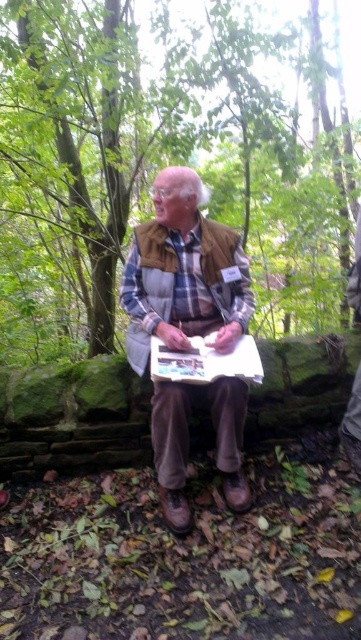
You are a hiker who just arrived at the forest clearing and see the green leafy tree at center and the white paper clipboard at center. You need to place a 10 feet long rope between them to hang a hammock. Will the rope be long enough?

The distance between the green leafy tree at center and the white paper clipboard at center is 7.75 feet. Since the rope is 10 feet long, which is longer than the distance, the rope will be long enough to hang the hammock between them.

You are a photographer trying to capture the man in the forest. You notice two points in the scene at coordinates point (177, 125) and point (166, 218). Which point is closer to your camera lens?

Point (166, 218) is closer to the camera lens because the Objects Description states that point (177, 125) is further to the camera than point (166, 218).

You are standing at the point labeled as point (203,346) and want to walk towards the point labeled as point (302,195). Based on the scene description, will you be moving forward or backward?

Since point (302,195) is behind point (203,346), moving towards it would mean you are moving backward.